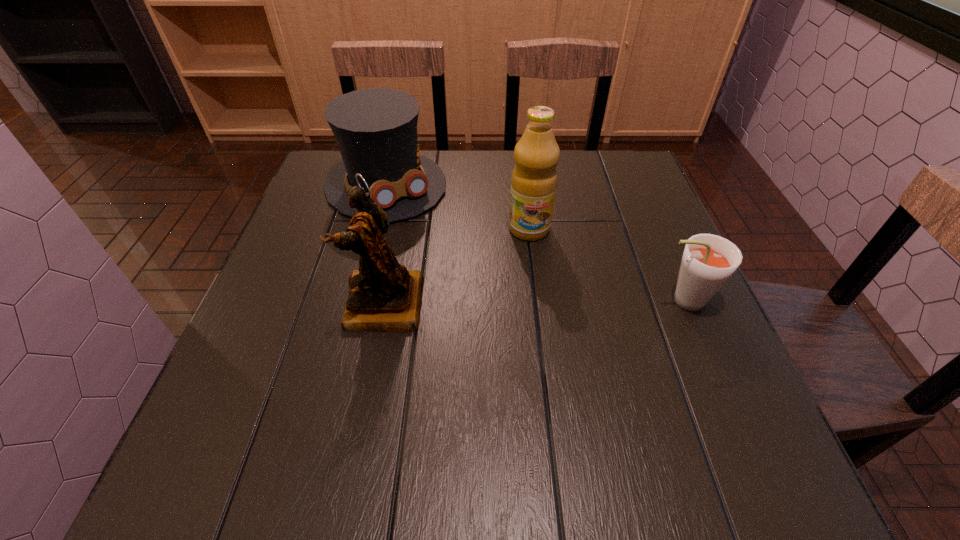
Locate an element on the screen. free space at the near edge is located at coordinates (330, 377).

At what (x,y) coordinates should I click in order to perform the action: click on free space at the left edge of the desktop. Please return your answer as a coordinate pair (x, y). The width and height of the screenshot is (960, 540). Looking at the image, I should click on (287, 237).

Where is `blank space at the right edge of the desktop`? This screenshot has width=960, height=540. blank space at the right edge of the desktop is located at coordinates (628, 247).

Where is `blank space at the far left corner of the desktop`? Image resolution: width=960 pixels, height=540 pixels. blank space at the far left corner of the desktop is located at coordinates (326, 161).

In the image, there is a desktop. Identify the location of free space at the near left corner. (218, 421).

In the image, there is a desktop. Identify the location of vacant region at the far right corner. (612, 183).

Where is `unoccupied area between the second object from right to left and the second shortest object`? unoccupied area between the second object from right to left and the second shortest object is located at coordinates (458, 207).

The height and width of the screenshot is (540, 960). Identify the location of free spot between the third object from left to right and the figurine. (456, 267).

The image size is (960, 540). I want to click on free spot between the olive oil and the second shortest object, so click(458, 207).

Locate an element on the screen. The width and height of the screenshot is (960, 540). free point between the dress hat and the second object from right to left is located at coordinates (458, 207).